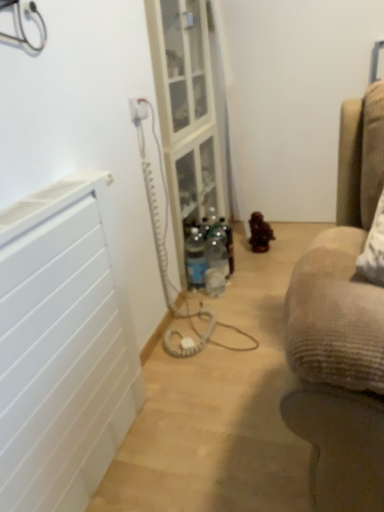
You are a GUI agent. You are given a task and a screenshot of the screen. Output one action in this format:
    pyautogui.click(x=<x>, y=<y>)
    Task: Click on the vacant space underneath white matte radiator at left (from a real-world perspective)
    The image size is (384, 512).
    Given the screenshot: What is the action you would take?
    pyautogui.click(x=124, y=440)